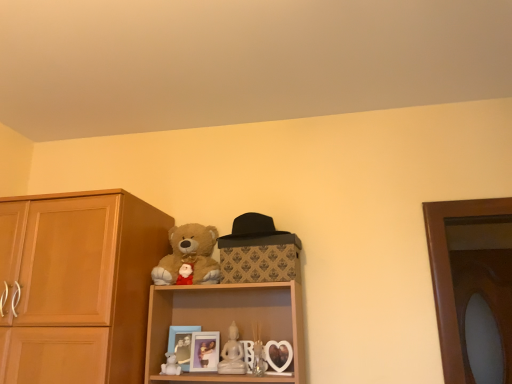
Question: From the image's perspective, is matte plastic picture frame at center, the first picture frame in the right-to-left sequence, positioned above or below soft plush teddy bear at upper center?

Choices:
 (A) above
 (B) below

Answer: (B)

Question: Would you say matte plastic picture frame at center, the first picture frame in the right-to-left sequence, is inside or outside soft plush teddy bear at upper center?

Choices:
 (A) outside
 (B) inside

Answer: (A)

Question: Based on their relative distances, which object is farther from the white matte teddy bear at lower center?

Choices:
 (A) matte blue picture frame at lower center, which appears as the 2th picture frame when viewed from the right
 (B) light brown wood cabinet at left
 (C) white porcelain figurine at center
 (D) transparent glass door at right
 (E) matte plastic picture frame at center, the first picture frame in the right-to-left sequence

Answer: (D)

Question: Estimate the real-world distances between objects in this image. Which object is farther from the light brown wood cabinet at left?

Choices:
 (A) matte plastic picture frame at center, the 2th picture frame from the left
 (B) white matte teddy bear at lower center
 (C) white porcelain figurine at center
 (D) matte blue picture frame at lower center, which appears as the 2th picture frame when viewed from the right
 (E) soft plush teddy bear at upper center

Answer: (C)